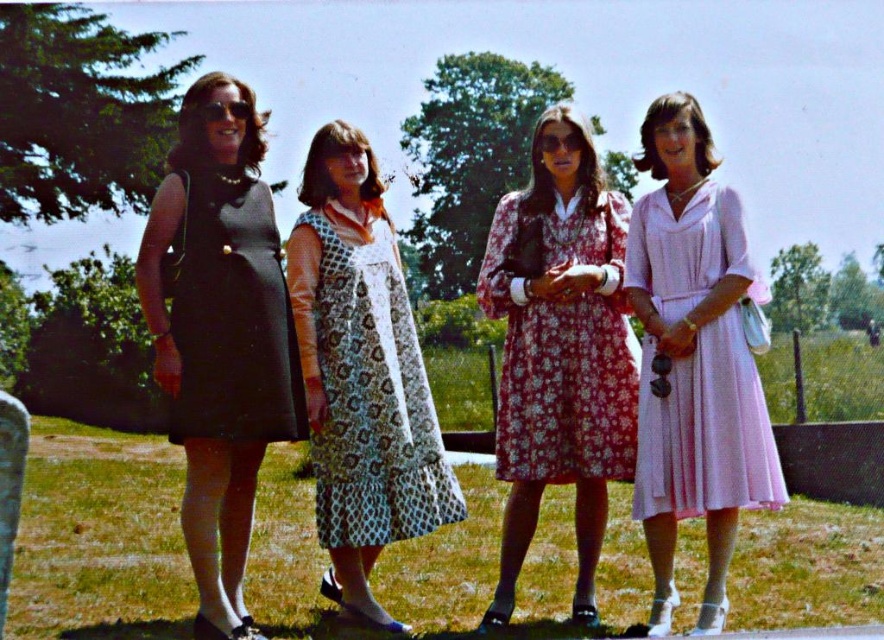
In the scene, there are two women wearing the matte black dress at left and the pink satin dress at right. Which woman is taller?

The matte black dress at left is taller than the pink satin dress at right, so the woman wearing the matte black dress at left is taller.

You are a photographer wanting to capture both the printed fabric dress at center and the floral cotton dress at center in the same frame. Based on their heights, which dress will appear taller in the photo?

The printed fabric dress at center will appear taller in the photo because it has a greater height compared to the floral cotton dress at center.

You are a fashion designer observing the women in the image. You need to determine which dress is taller between the pink satin dress at right and the floral cotton dress at center. Based on the scene, which one is taller?

The pink satin dress at right is taller than the floral cotton dress at center.